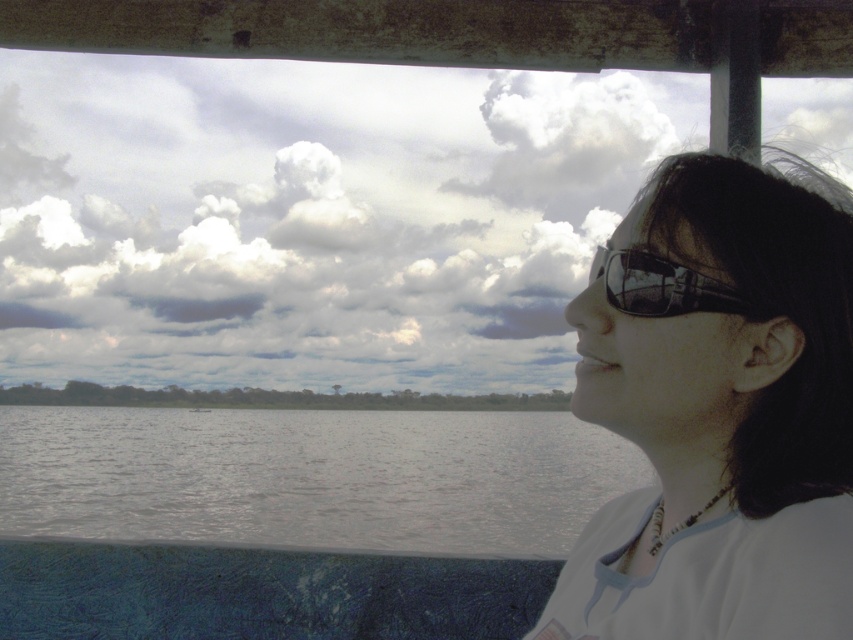
Question: Does matte white shirt at right appear over gray matte water at center?

Choices:
 (A) no
 (B) yes

Answer: (B)

Question: Which of the following is the closest to the observer?

Choices:
 (A) matte white shirt at right
 (B) transparent plastic glasses at upper right
 (C) gray matte water at center

Answer: (A)

Question: Is matte white shirt at right above gray matte water at center?

Choices:
 (A) yes
 (B) no

Answer: (A)

Question: Which object is closer to the camera taking this photo?

Choices:
 (A) gray matte water at center
 (B) matte white shirt at right

Answer: (B)

Question: Observing the image, what is the correct spatial positioning of matte white shirt at right in reference to transparent plastic glasses at upper right?

Choices:
 (A) right
 (B) left

Answer: (A)

Question: Which object appears closest to the camera in this image?

Choices:
 (A) matte white shirt at right
 (B) transparent plastic glasses at upper right
 (C) gray matte water at center

Answer: (A)